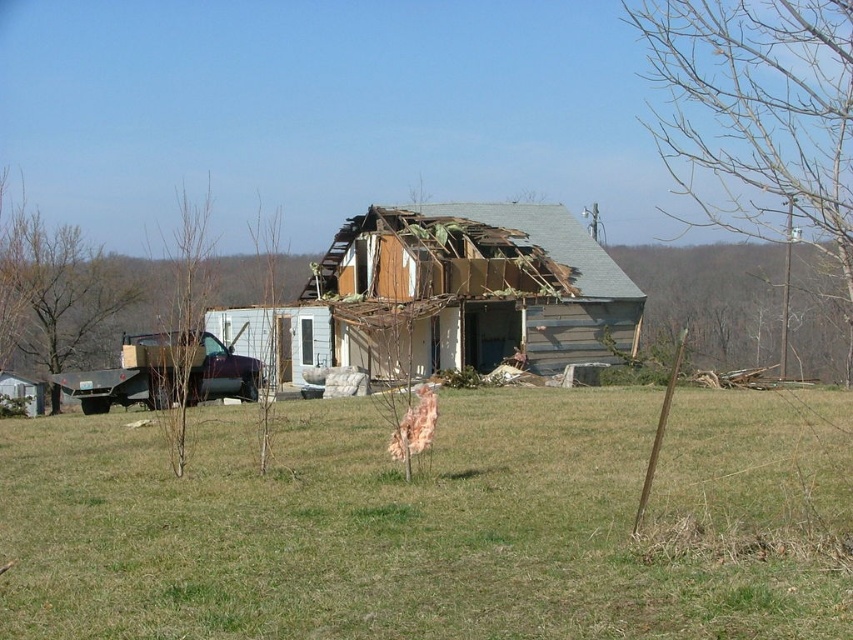
Is point (222, 497) positioned before point (407, 260)?

Yes.

Can you confirm if green grass at center is positioned below wooden house at center?

A: Yes, green grass at center is below wooden house at center.

You are a GUI agent. You are given a task and a screenshot of the screen. Output one action in this format:
    pyautogui.click(x=<x>, y=<y>)
    Task: Click on the green grass at center
    The image size is (853, 640).
    Given the screenshot: What is the action you would take?
    pyautogui.click(x=375, y=531)